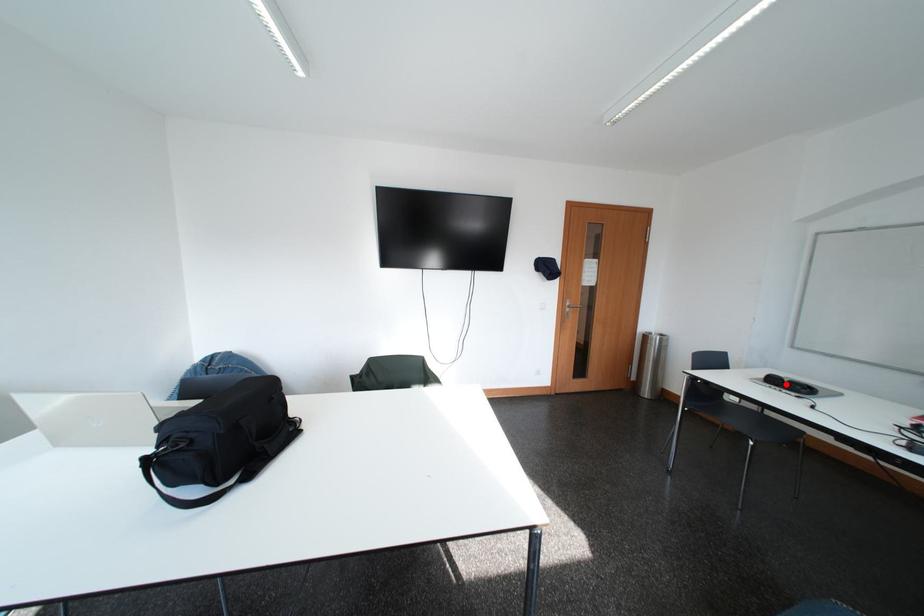
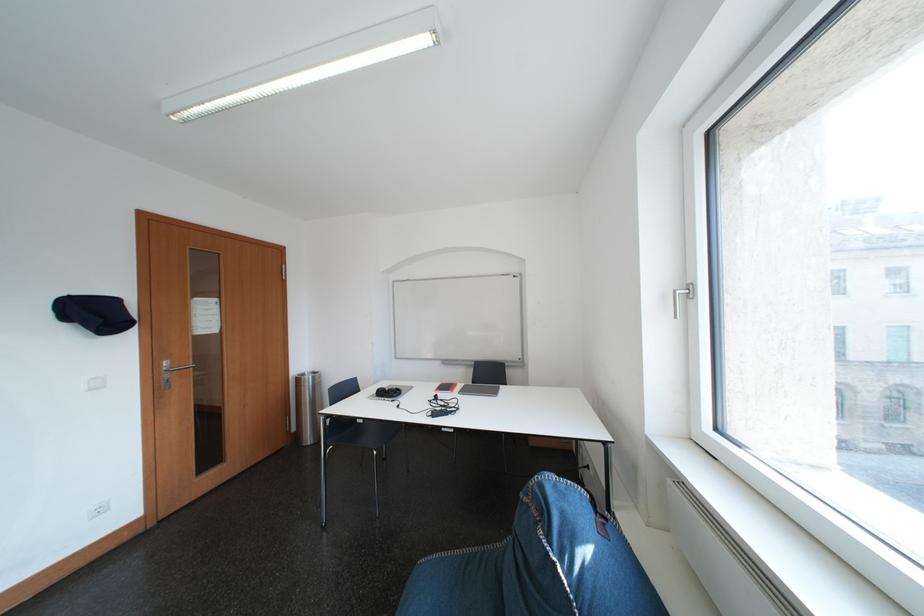
Where in the second image is the point corresponding to the highlighted location from the first image?

(393, 395)